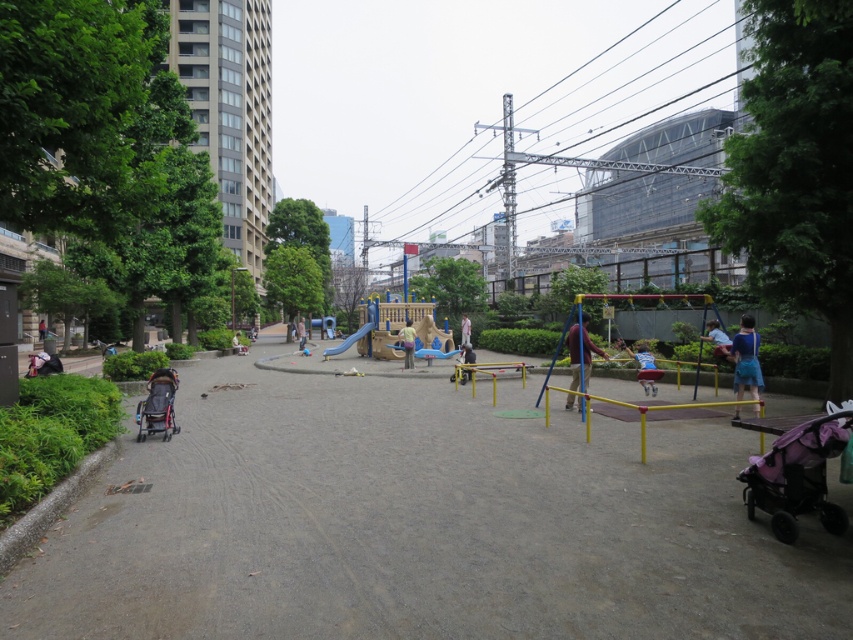
Question: Which of the following is the farthest from the observer?

Choices:
 (A) blue fabric at center
 (B) blue plastic slide at center
 (C) smooth plastic slide at center

Answer: (B)

Question: Can you confirm if smooth concrete path at center is positioned to the right of smooth plastic slide at center?

Choices:
 (A) no
 (B) yes

Answer: (B)

Question: Is yellow plastic slide at center to the right of dark blue stroller at left from the viewer's perspective?

Choices:
 (A) no
 (B) yes

Answer: (B)

Question: Which point is farther from the camera taking this photo?

Choices:
 (A) (712, 332)
 (B) (160, 388)

Answer: (A)

Question: Based on their relative distances, which object is nearer to the smooth plastic slide at center?

Choices:
 (A) blue plastic slide at center
 (B) smooth concrete path at center
 (C) blue denim shorts at right

Answer: (A)

Question: Observing the image, what is the correct spatial positioning of blue denim shorts at right in reference to smooth plastic slide at center?

Choices:
 (A) above
 (B) below

Answer: (B)